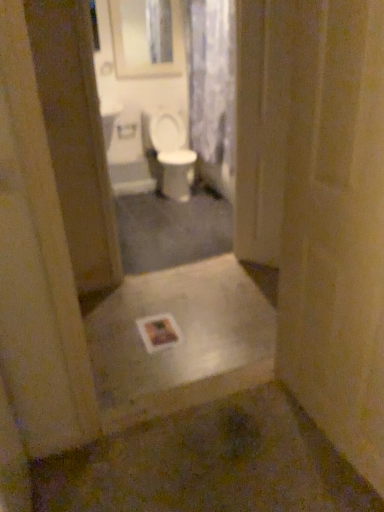
Question: Does translucent floral fabric at upper center have a lesser height compared to white glossy toilet at center?

Choices:
 (A) no
 (B) yes

Answer: (A)

Question: From a real-world perspective, is translucent floral fabric at upper center physically below white glossy toilet at center?

Choices:
 (A) yes
 (B) no

Answer: (B)

Question: From the image's perspective, is translucent floral fabric at upper center below white glossy toilet at center?

Choices:
 (A) no
 (B) yes

Answer: (A)

Question: Is translucent floral fabric at upper center facing towards white glossy toilet at center?

Choices:
 (A) no
 (B) yes

Answer: (B)

Question: Is translucent floral fabric at upper center further to camera compared to white glossy toilet at center?

Choices:
 (A) yes
 (B) no

Answer: (B)

Question: Is translucent floral fabric at upper center located outside white glossy toilet at center?

Choices:
 (A) no
 (B) yes

Answer: (B)

Question: Considering the relative sizes of white matte toilet paper at center and white glossy toilet at center in the image provided, is white matte toilet paper at center smaller than white glossy toilet at center?

Choices:
 (A) no
 (B) yes

Answer: (B)

Question: Can you confirm if white matte toilet paper at center is taller than white glossy toilet at center?

Choices:
 (A) yes
 (B) no

Answer: (B)

Question: Is white matte toilet paper at center facing towards white glossy toilet at center?

Choices:
 (A) yes
 (B) no

Answer: (B)

Question: From the image's perspective, does white matte toilet paper at center appear lower than white glossy toilet at center?

Choices:
 (A) yes
 (B) no

Answer: (B)

Question: From a real-world perspective, is white matte toilet paper at center below white glossy toilet at center?

Choices:
 (A) no
 (B) yes

Answer: (A)

Question: Can you confirm if white matte toilet paper at center is wider than white glossy toilet at center?

Choices:
 (A) no
 (B) yes

Answer: (A)

Question: From a real-world perspective, is white matte toilet paper at center located beneath translucent floral fabric at upper center?

Choices:
 (A) yes
 (B) no

Answer: (A)